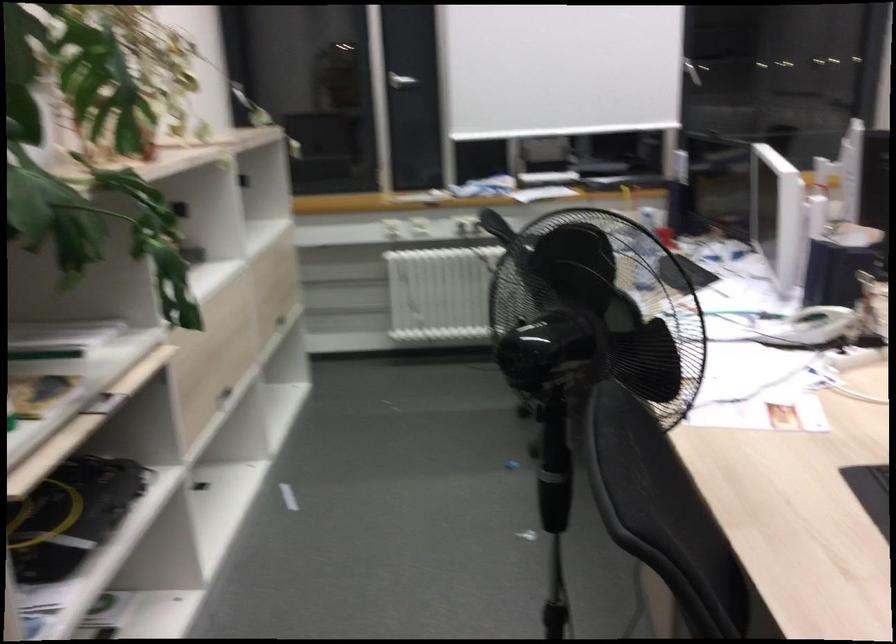
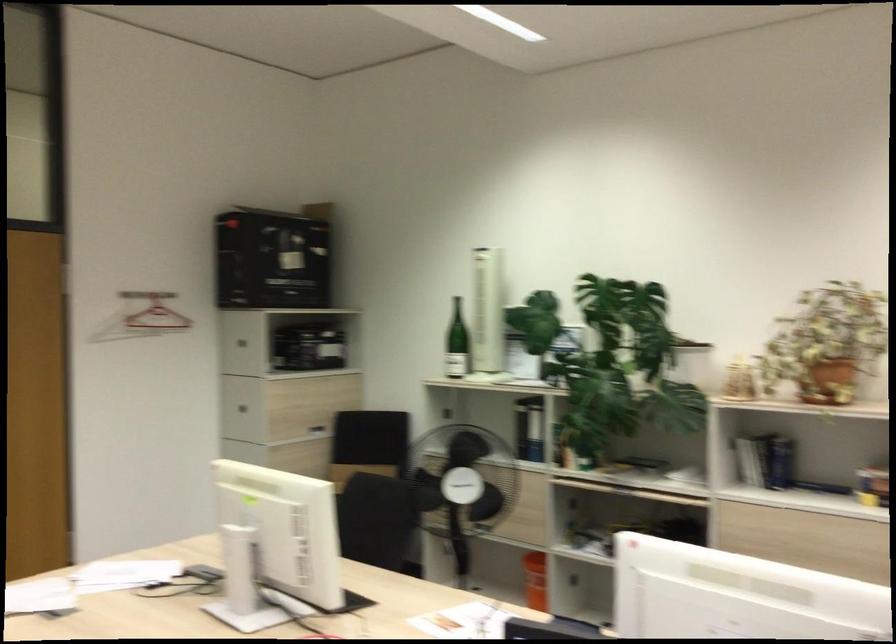
Question: I am providing you with two images of the same scene from different viewpoints. Which of the following objects are not visible in image2?

Choices:
 (A) drawer handle
 (B) drawer pull
 (C) chair sitting surface
 (D) white door frame

Answer: (A)